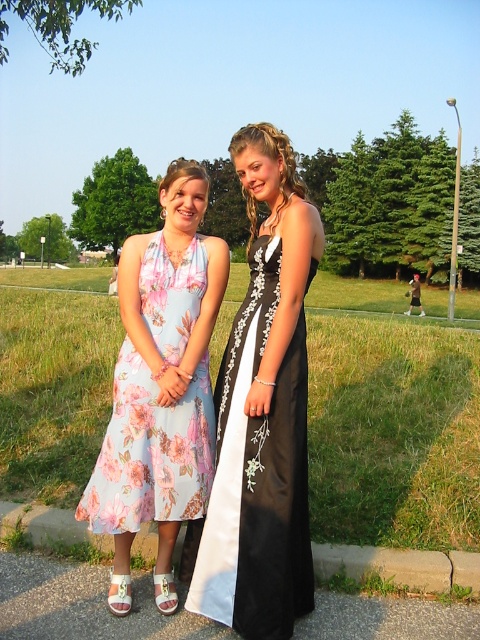
Does black satin dress at center have a greater width compared to floral silk dress at left?

No, black satin dress at center is not wider than floral silk dress at left.

Can you confirm if black satin dress at center is taller than floral silk dress at left?

Correct, black satin dress at center is much taller as floral silk dress at left.

Is point (277, 472) behind point (181, 470)?

No, (277, 472) is closer to viewer.

Locate an element on the screen. This screenshot has width=480, height=640. black satin dress at center is located at coordinates (255, 477).

Can you confirm if floral silk dress at left is smaller than concrete at lower center?

Incorrect, floral silk dress at left is not smaller in size than concrete at lower center.

Which is below, floral silk dress at left or concrete at lower center?

concrete at lower center

You are a GUI agent. You are given a task and a screenshot of the screen. Output one action in this format:
    pyautogui.click(x=<x>, y=<y>)
    Task: Click on the floral silk dress at left
    The width and height of the screenshot is (480, 640).
    Given the screenshot: What is the action you would take?
    pyautogui.click(x=151, y=451)

Find the location of a particular element. floral silk dress at left is located at coordinates (151, 451).

Looking at this image, measure the distance between point (289, 426) and camera.

2.72 meters

Does point (228, 488) come behind point (459, 556)?

No, (228, 488) is closer to viewer.

I want to click on black satin dress at center, so click(x=255, y=477).